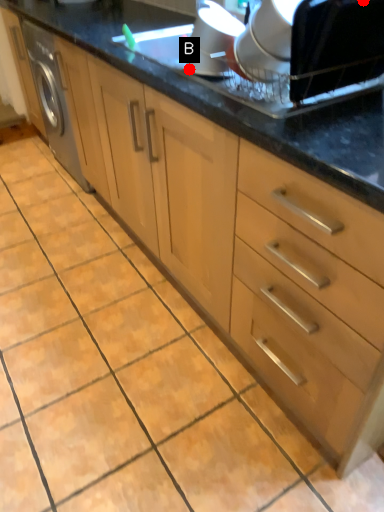
Question: Two points are circled on the image, labeled by A and B beside each circle. Which point is farther from the camera taking this photo?

Choices:
 (A) A is further
 (B) B is further

Answer: (B)